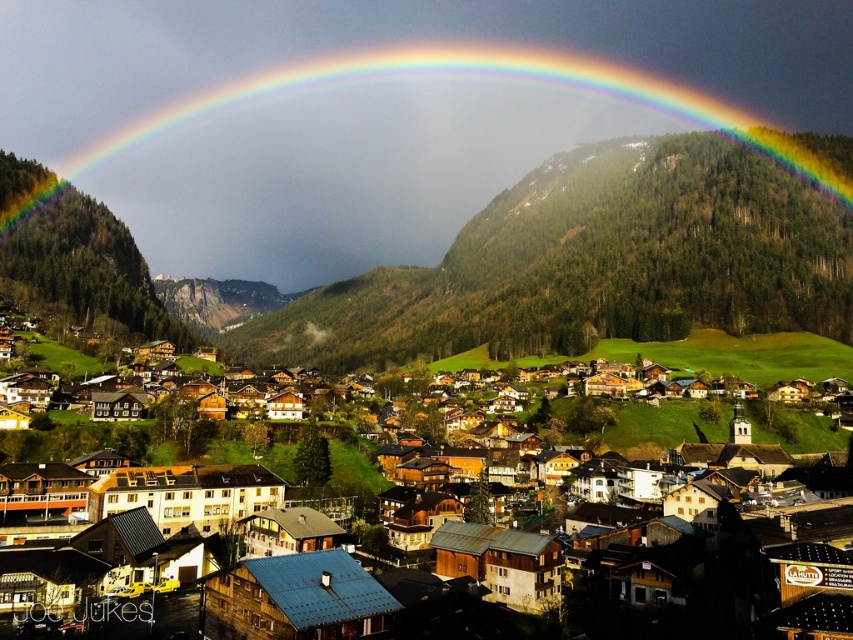
Question: Which point appears farthest from the camera in this image?

Choices:
 (A) (815, 355)
 (B) (699, 29)

Answer: (B)

Question: Can you confirm if rainbow at upper center is positioned to the right of wooden houses at center?

Choices:
 (A) no
 (B) yes

Answer: (A)

Question: Can you confirm if rainbow at upper center is bigger than wooden houses at center?

Choices:
 (A) yes
 (B) no

Answer: (A)

Question: Is rainbow at upper center positioned at the back of wooden houses at center?

Choices:
 (A) no
 (B) yes

Answer: (B)

Question: Which object is farther from the camera taking this photo?

Choices:
 (A) rainbow at upper center
 (B) wooden houses at center

Answer: (A)